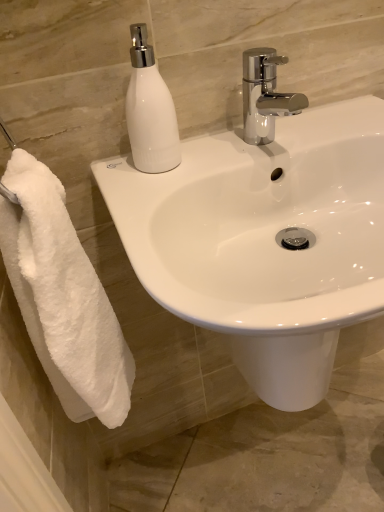
Question: From the image's perspective, is white fluffy towel at left over white glossy soap dispenser at upper left?

Choices:
 (A) no
 (B) yes

Answer: (A)

Question: Considering the relative sizes of white fluffy towel at left and white glossy soap dispenser at upper left in the image provided, is white fluffy towel at left wider than white glossy soap dispenser at upper left?

Choices:
 (A) no
 (B) yes

Answer: (B)

Question: Is white fluffy towel at left turned away from white glossy soap dispenser at upper left?

Choices:
 (A) no
 (B) yes

Answer: (A)

Question: Could you tell me if white fluffy towel at left is turned towards white glossy soap dispenser at upper left?

Choices:
 (A) yes
 (B) no

Answer: (A)

Question: Can you confirm if white fluffy towel at left is bigger than white glossy soap dispenser at upper left?

Choices:
 (A) yes
 (B) no

Answer: (A)

Question: Is white fluffy towel at left further to the viewer compared to white glossy soap dispenser at upper left?

Choices:
 (A) yes
 (B) no

Answer: (B)

Question: Considering the relative sizes of white glossy soap dispenser at upper left and chrome metallic faucet at upper center in the image provided, is white glossy soap dispenser at upper left smaller than chrome metallic faucet at upper center?

Choices:
 (A) no
 (B) yes

Answer: (B)

Question: From a real-world perspective, is white glossy soap dispenser at upper left on chrome metallic faucet at upper center?

Choices:
 (A) yes
 (B) no

Answer: (A)

Question: From a real-world perspective, is white glossy soap dispenser at upper left located beneath chrome metallic faucet at upper center?

Choices:
 (A) no
 (B) yes

Answer: (A)

Question: Considering the relative sizes of white glossy soap dispenser at upper left and chrome metallic faucet at upper center in the image provided, is white glossy soap dispenser at upper left taller than chrome metallic faucet at upper center?

Choices:
 (A) no
 (B) yes

Answer: (B)

Question: Is white glossy soap dispenser at upper left oriented towards chrome metallic faucet at upper center?

Choices:
 (A) no
 (B) yes

Answer: (A)

Question: Is white glossy soap dispenser at upper left positioned before chrome metallic faucet at upper center?

Choices:
 (A) yes
 (B) no

Answer: (A)

Question: Can you confirm if white glossy soap dispenser at upper left is wider than white fluffy towel at left?

Choices:
 (A) no
 (B) yes

Answer: (A)